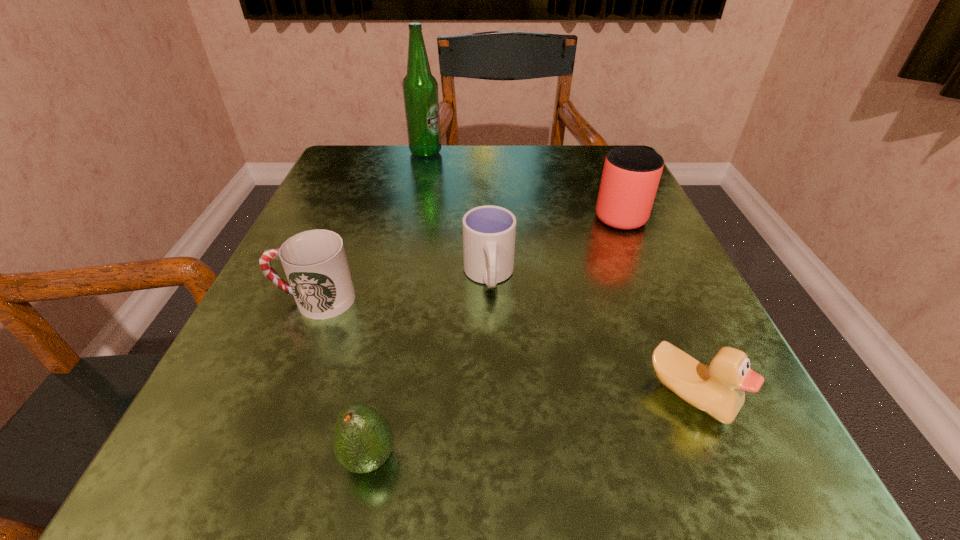
The image size is (960, 540). Find the location of `cup that is the second closest to the second cup from left to right`. cup that is the second closest to the second cup from left to right is located at coordinates (631, 174).

Locate an element on the screen. The height and width of the screenshot is (540, 960). free space that satisfies the following two spatial constraints: 1. on the handle side of the leftmost cup; 2. on the handle side of the tallest cup is located at coordinates (350, 212).

You are a GUI agent. You are given a task and a screenshot of the screen. Output one action in this format:
    pyautogui.click(x=<x>, y=<y>)
    Task: Click on the free spot that satisfies the following two spatial constraints: 1. on the handle side of the fifth shortest object; 2. on the label of the farthest object
    
    Given the screenshot: What is the action you would take?
    pyautogui.click(x=592, y=153)

The image size is (960, 540). Find the location of `blank area in the image that satisfies the following two spatial constraints: 1. on the label of the beer bottle; 2. on the right side of the nearest object`. blank area in the image that satisfies the following two spatial constraints: 1. on the label of the beer bottle; 2. on the right side of the nearest object is located at coordinates (362, 458).